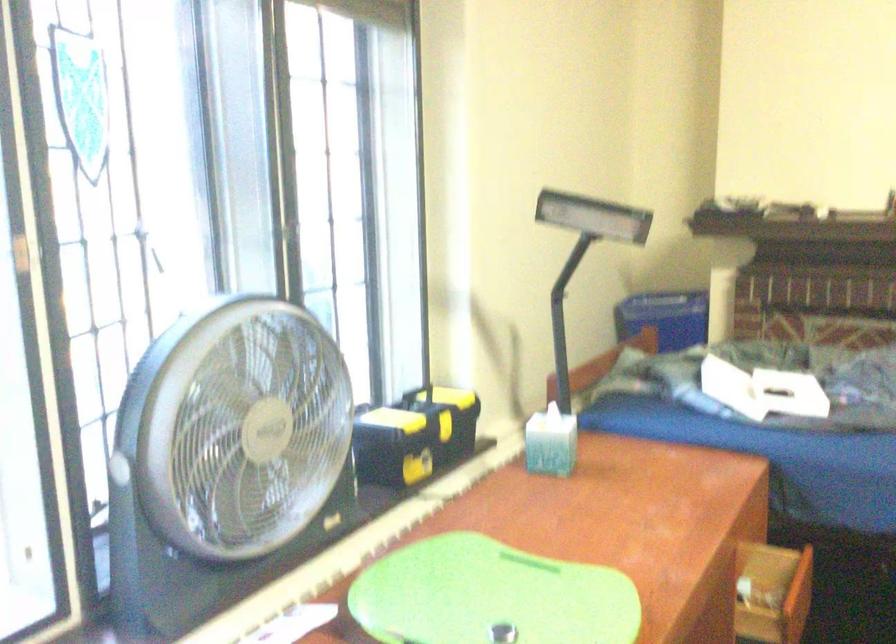
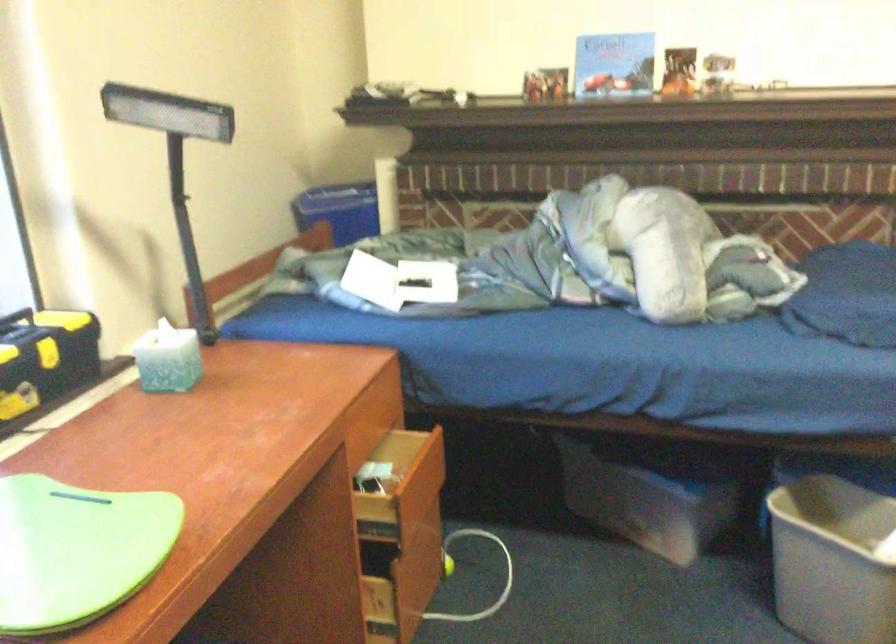
Question: In a continuous first-person perspective shot, in which direction is the camera moving?

Choices:
 (A) Left
 (B) Right
 (C) Forward
 (D) Backward

Answer: (B)